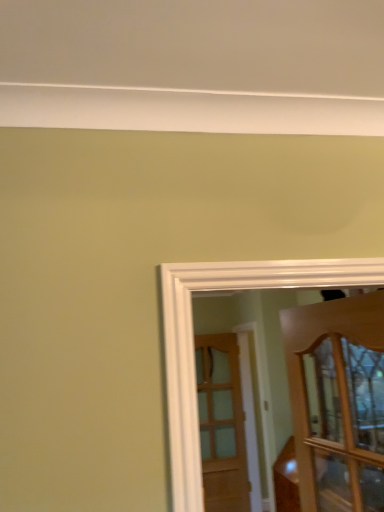
Question: Does wooden door at center, positioned as the 1th door in bottom-to-top order, turn towards wooden cabinet at right, placed as the 1th door when sorted from front to back?

Choices:
 (A) no
 (B) yes

Answer: (B)

Question: Considering the relative sizes of wooden door at center, positioned as the 1th door in bottom-to-top order, and wooden cabinet at right, the second door viewed from the back, in the image provided, is wooden door at center, positioned as the 1th door in bottom-to-top order, taller than wooden cabinet at right, the second door viewed from the back,?

Choices:
 (A) no
 (B) yes

Answer: (B)

Question: Is wooden door at center, positioned as the 1th door in bottom-to-top order, in front of wooden cabinet at right, which appears as the 1th door when viewed from the top?

Choices:
 (A) no
 (B) yes

Answer: (A)

Question: Is wooden door at center, the 2th door from the front, at the left side of wooden cabinet at right, placed as the 1th door when sorted from front to back?

Choices:
 (A) no
 (B) yes

Answer: (B)

Question: Can you confirm if wooden door at center, which appears as the second door when viewed from the top, is shorter than wooden cabinet at right, placed as the 1th door when sorted from front to back?

Choices:
 (A) no
 (B) yes

Answer: (A)

Question: From the image's perspective, would you say wooden door at center, which appears as the second door when viewed from the top, is shown under wooden cabinet at right, the 2th door when ordered from bottom to top?

Choices:
 (A) no
 (B) yes

Answer: (B)

Question: Does wooden cabinet at right, which appears as the 1th door when viewed from the top, appear on the right side of wooden door at center, positioned as the 1th door in bottom-to-top order?

Choices:
 (A) yes
 (B) no

Answer: (A)

Question: Can we say wooden cabinet at right, placed as the 1th door when sorted from front to back, lies outside wooden door at center, positioned as the first door in back-to-front order?

Choices:
 (A) yes
 (B) no

Answer: (A)

Question: Does wooden cabinet at right, which appears as the 1th door when viewed from the top, have a lesser width compared to wooden door at center, the 2th door from the front?

Choices:
 (A) yes
 (B) no

Answer: (B)

Question: Considering the relative positions of wooden cabinet at right, which appears as the 1th door when viewed from the top, and wooden door at center, positioned as the first door in back-to-front order, in the image provided, is wooden cabinet at right, which appears as the 1th door when viewed from the top, behind wooden door at center, positioned as the first door in back-to-front order,?

Choices:
 (A) yes
 (B) no

Answer: (B)

Question: Considering the relative sizes of wooden cabinet at right, placed as the 1th door when sorted from front to back, and wooden door at center, the 2th door from the front, in the image provided, is wooden cabinet at right, placed as the 1th door when sorted from front to back, taller than wooden door at center, the 2th door from the front,?

Choices:
 (A) yes
 (B) no

Answer: (B)

Question: From the image's perspective, does wooden cabinet at right, placed as the 1th door when sorted from front to back, appear lower than wooden door at center, which appears as the second door when viewed from the top?

Choices:
 (A) yes
 (B) no

Answer: (B)

Question: From their relative heights in the image, would you say wooden door at center, positioned as the 1th door in bottom-to-top order, is taller or shorter than wooden cabinet at right, the second door viewed from the back?

Choices:
 (A) short
 (B) tall

Answer: (B)